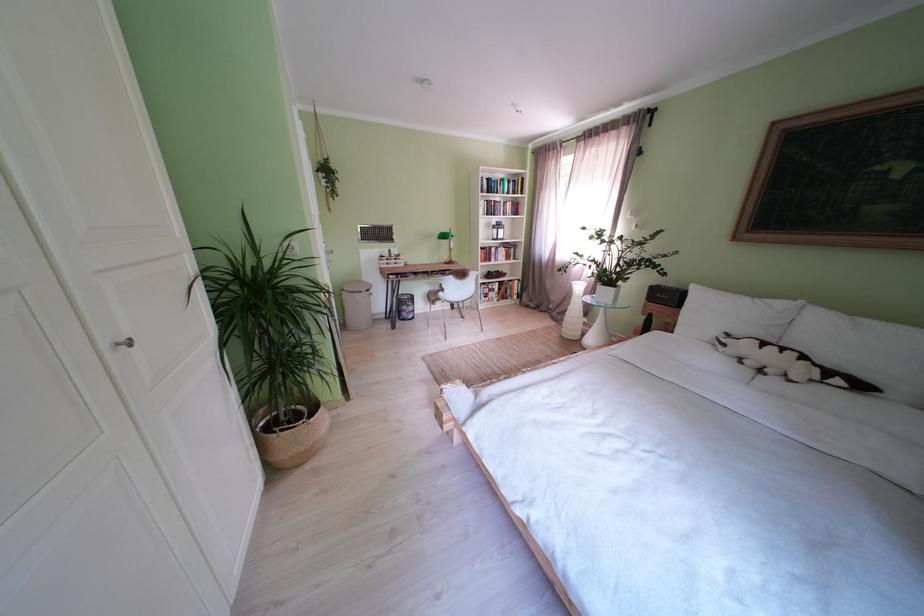
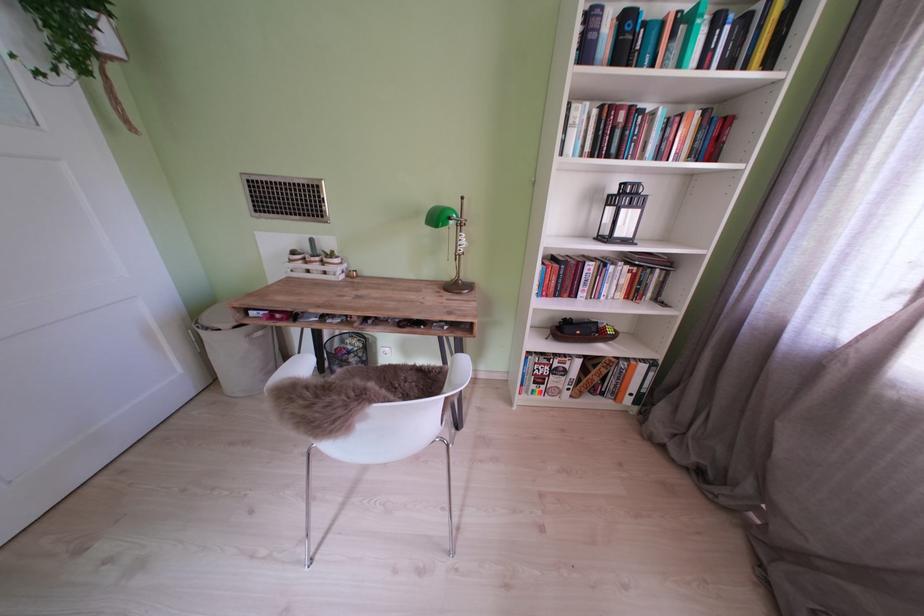
Question: What movement of the cameraman would produce the second image?

Choices:
 (A) Left
 (B) Right
 (C) Forward
 (D) Backward

Answer: (C)